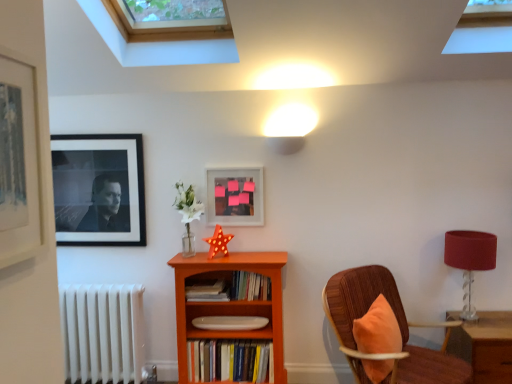
The height and width of the screenshot is (384, 512). What do you see at coordinates (399, 327) in the screenshot?
I see `wooden chair with orange cushion at right` at bounding box center [399, 327].

This screenshot has width=512, height=384. Describe the element at coordinates (234, 196) in the screenshot. I see `matte glass picture frame at center, which appears as the second picture frame when viewed from the front` at that location.

Measure the distance between point (231, 290) and camera.

The depth of point (231, 290) is 9.49 feet.

Measure the distance between hardcover books at center, which is counted as the first book, starting from the top, and camera.

hardcover books at center, which is counted as the first book, starting from the top, is 9.31 feet away from camera.

Where is `wooden chair with orange cushion at right`? wooden chair with orange cushion at right is located at coordinates (399, 327).

Which object is further away from the camera, white metallic radiator at lower left or hardcover books at center, acting as the third book starting from the bottom?

white metallic radiator at lower left is behind.

From the image's perspective, would you say white metallic radiator at lower left is positioned over hardcover books at center, acting as the third book starting from the bottom?

No, from the image's perspective, white metallic radiator at lower left is not on top of hardcover books at center, acting as the third book starting from the bottom.

Would you consider white metallic radiator at lower left to be distant from hardcover books at center, acting as the third book starting from the bottom?

No, white metallic radiator at lower left is in close proximity to hardcover books at center, acting as the third book starting from the bottom.

At what (x,y) coordinates should I click in order to perform the action: click on radiator that is below the hardcover books at center, acting as the third book starting from the bottom (from the image's perspective). Please return your answer as a coordinate pair (x, y). This screenshot has height=384, width=512. Looking at the image, I should click on (103, 332).

Based on the photo, would you say matte black picture frame at upper left, which is counted as the 3th picture frame, starting from the right, is inside or outside white metallic radiator at lower left?

matte black picture frame at upper left, which is counted as the 3th picture frame, starting from the right, is located beyond the bounds of white metallic radiator at lower left.

Locate an element on the screen. This screenshot has width=512, height=384. the 2nd picture frame above the white metallic radiator at lower left (from the image's perspective) is located at coordinates 99,189.

In the scene shown: Is matte black picture frame at upper left, the first picture frame from the back, next to white metallic radiator at lower left and touching it?

No, matte black picture frame at upper left, the first picture frame from the back, is not next to white metallic radiator at lower left.

Does point (214, 280) lie in front of point (449, 321)?

No, it is not.

Considering the relative positions of hardcover book at center, the 2th book when ordered from bottom to top, and wooden chair with orange cushion at right in the image provided, is hardcover book at center, the 2th book when ordered from bottom to top, to the left of wooden chair with orange cushion at right from the viewer's perspective?

Indeed, hardcover book at center, the 2th book when ordered from bottom to top, is positioned on the left side of wooden chair with orange cushion at right.

From the image's perspective, is hardcover book at center, the 2th book when ordered from bottom to top, located above or below wooden chair with orange cushion at right?

Clearly, from the image's perspective, hardcover book at center, the 2th book when ordered from bottom to top, is above wooden chair with orange cushion at right.

Which of these two, matte glass picture frame at center, marked as the second picture frame in a back-to-front arrangement, or matte black picture frame at upper left, which is counted as the first picture frame, starting from the left, stands taller?

matte black picture frame at upper left, which is counted as the first picture frame, starting from the left, is taller.

How much distance is there between matte glass picture frame at center, arranged as the 3th picture frame when viewed from the left, and matte black picture frame at upper left, arranged as the third picture frame when viewed from the front?

They are 29.92 inches apart.

Based on their positions, is matte glass picture frame at center, which is counted as the first picture frame, starting from the right, located to the left or right of matte black picture frame at upper left, which is counted as the 3th picture frame, starting from the right?

From the image, it's evident that matte glass picture frame at center, which is counted as the first picture frame, starting from the right, is to the right of matte black picture frame at upper left, which is counted as the 3th picture frame, starting from the right.

Which object is further away from the camera, matte glass picture frame at center, marked as the second picture frame in a back-to-front arrangement, or matte black picture frame at upper left, arranged as the third picture frame when viewed from the front?

matte black picture frame at upper left, arranged as the third picture frame when viewed from the front, is more distant.

How many degrees apart are the facing directions of velvet red lampshade at right and hardcover book at center, the 2th book when ordered from bottom to top?

The angular difference between velvet red lampshade at right and hardcover book at center, the 2th book when ordered from bottom to top, is 0.106 degrees.

From a real-world perspective, is velvet red lampshade at right physically below hardcover book at center, the 2th book when ordered from bottom to top?

No, from a real-world perspective, velvet red lampshade at right is not under hardcover book at center, the 2th book when ordered from bottom to top.

From the image's perspective, is velvet red lampshade at right on hardcover book at center, the 2th book when ordered from bottom to top?

Indeed, from the image's perspective, velvet red lampshade at right is shown above hardcover book at center, the 2th book when ordered from bottom to top.

In terms of size, does velvet red lampshade at right appear bigger or smaller than hardcover book at center, the second book from the top?

Clearly, velvet red lampshade at right is larger in size than hardcover book at center, the second book from the top.

Would you say white metallic radiator at lower left is a long distance from matte black picture frame at left, marked as the 3th picture frame in a back-to-front arrangement?

white metallic radiator at lower left is far away from matte black picture frame at left, marked as the 3th picture frame in a back-to-front arrangement.

Is white metallic radiator at lower left facing away from matte black picture frame at left, marked as the second picture frame in a right-to-left arrangement?

No, white metallic radiator at lower left is not facing the opposite direction of matte black picture frame at left, marked as the second picture frame in a right-to-left arrangement.

This screenshot has height=384, width=512. In order to click on picture frame that is the 1st one when counting rightward from the white metallic radiator at lower left in this screenshot , I will do `click(19, 163)`.

Could you measure the distance between white metallic radiator at lower left and matte black picture frame at left, the first picture frame in the front-to-back sequence?

The distance of white metallic radiator at lower left from matte black picture frame at left, the first picture frame in the front-to-back sequence, is 2.33 meters.

From the image's perspective, is hardcover book at center, the 2th book when ordered from bottom to top, located above or below orange wood bookcase at center?

hardcover book at center, the 2th book when ordered from bottom to top, is situated higher than orange wood bookcase at center in the image.

Is hardcover book at center, the 2th book when ordered from bottom to top, surrounding orange wood bookcase at center?

No, orange wood bookcase at center is not inside hardcover book at center, the 2th book when ordered from bottom to top.

Considering the points (215, 283) and (273, 306), which point is behind, point (215, 283) or point (273, 306)?

The point (215, 283) is behind.

From the picture: Is hardcover book at center, the second book from the top, far away from orange wood bookcase at center?

No, hardcover book at center, the second book from the top, is in close proximity to orange wood bookcase at center.

Where is `radiator that appears on the left of hardcover books at center, which is counted as the first book, starting from the top`? radiator that appears on the left of hardcover books at center, which is counted as the first book, starting from the top is located at coordinates (103, 332).

From the image's perspective, count 2nd picture frames upward from the white metallic radiator at lower left and point to it. Please provide its 2D coordinates.

[(99, 189)]

Which object lies nearer to the anchor point matte black picture frame at upper left, arranged as the third picture frame when viewed from the front, white matte plate at center, the 3th book in the top-to-bottom sequence, or velvet red lampshade at right?

The object closer to matte black picture frame at upper left, arranged as the third picture frame when viewed from the front, is white matte plate at center, the 3th book in the top-to-bottom sequence.

From the image, which object appears to be nearer to matte black picture frame at left, the first picture frame in the front-to-back sequence, hardcover books at center, acting as the third book starting from the bottom, or clear glass skylight at upper center?

Among the two, clear glass skylight at upper center is located nearer to matte black picture frame at left, the first picture frame in the front-to-back sequence.

When comparing their distances from matte black picture frame at left, the first picture frame in the front-to-back sequence, does white matte plate at center, the 3th book in the top-to-bottom sequence, or matte black picture frame at upper left, which is counted as the first picture frame, starting from the left, seem further?

Among the two, white matte plate at center, the 3th book in the top-to-bottom sequence, is located further to matte black picture frame at left, the first picture frame in the front-to-back sequence.

Which object lies further to the anchor point hardcover book at center, the 2th book when ordered from bottom to top, white matte plate at center, which is counted as the first book, starting from the bottom, or velvet red lampshade at right?

velvet red lampshade at right.

When comparing their distances from orange wood bookcase at center, does matte glass picture frame at center, marked as the second picture frame in a back-to-front arrangement, or matte black picture frame at upper left, arranged as the third picture frame when viewed from the front, seem further?

matte black picture frame at upper left, arranged as the third picture frame when viewed from the front, lies further to orange wood bookcase at center than the other object.

From the image, which object appears to be farther from hardcover book at center, the 2th book when ordered from bottom to top, hardcover books at center, acting as the third book starting from the bottom, or clear glass skylight at upper center?

clear glass skylight at upper center is positioned further to the anchor hardcover book at center, the 2th book when ordered from bottom to top.

Looking at the image, which one is located closer to matte black picture frame at upper left, the first picture frame from the back, hardcover books at center, which is counted as the first book, starting from the top, or orange wood bookcase at center?

orange wood bookcase at center is closer to matte black picture frame at upper left, the first picture frame from the back.

Considering their positions, is matte black picture frame at upper left, which is counted as the first picture frame, starting from the left, positioned closer to matte glass picture frame at center, marked as the second picture frame in a back-to-front arrangement, than white matte plate at center, the 3th book in the top-to-bottom sequence?

matte black picture frame at upper left, which is counted as the first picture frame, starting from the left, lies closer to matte glass picture frame at center, marked as the second picture frame in a back-to-front arrangement, than the other object.

The width and height of the screenshot is (512, 384). What are the coordinates of `bookcase between matte black picture frame at left, marked as the second picture frame in a right-to-left arrangement, and white metallic radiator at lower left, along the z-axis` in the screenshot? It's located at (230, 303).

What are the coordinates of `book located between matte glass picture frame at center, which appears as the second picture frame when viewed from the front, and velvet red lampshade at right in the left-right direction` in the screenshot? It's located at (250, 286).

Identify the location of chair between hardcover book at center, the 2th book when ordered from bottom to top, and velvet red lampshade at right. The width and height of the screenshot is (512, 384). (399, 327).

Find the location of a particular element. window situated between matte black picture frame at upper left, arranged as the third picture frame when viewed from the front, and velvet red lampshade at right from left to right is located at coordinates (157, 45).